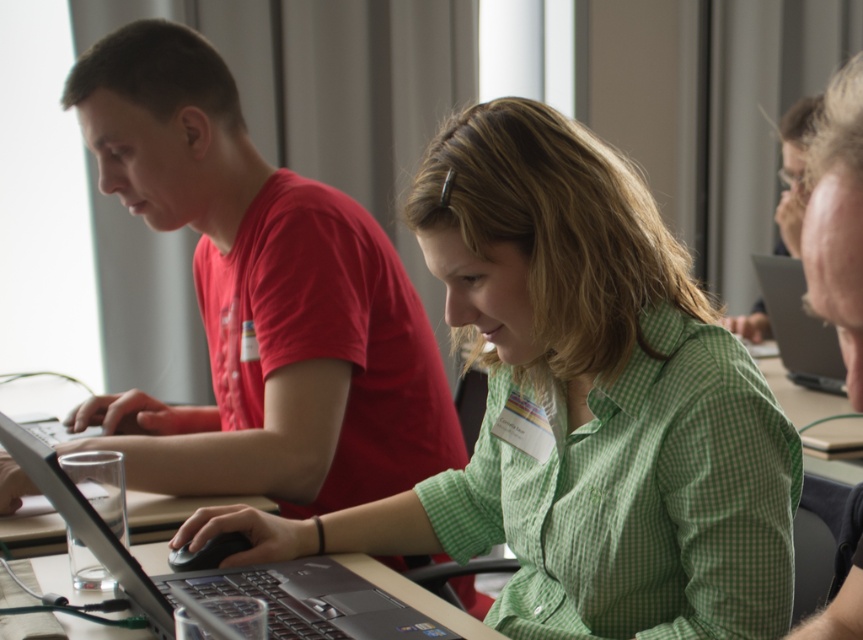
You are standing in the conference room and need to locate the silver metallic laptop at center. According to the coordinates provided, where exactly is it positioned?

The silver metallic laptop at center is positioned at coordinates point (320, 611).

Based on the photo, you are organizing a presentation and need to choose between the matte black laptop at left and the silver metallic laptop at right based on screen size. Which one should you pick if you want the larger screen?

The matte black laptop at left has a larger screen size compared to the silver metallic laptop at right, so you should pick the matte black laptop at left for your presentation.

You are standing at the entrance of the conference room and see two points marked in the scene. One is at point (502, 401) and the other at point (797, 273). Which point is closer to you?

Point (502, 401) is in front of point (797, 273), so it is closer to you.